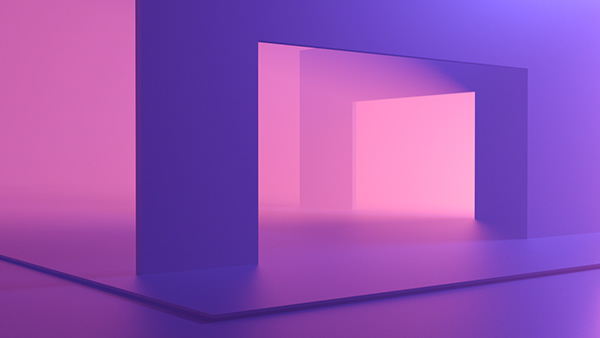
Where is `floor shadow`? The height and width of the screenshot is (338, 600). floor shadow is located at coordinates (315, 225).